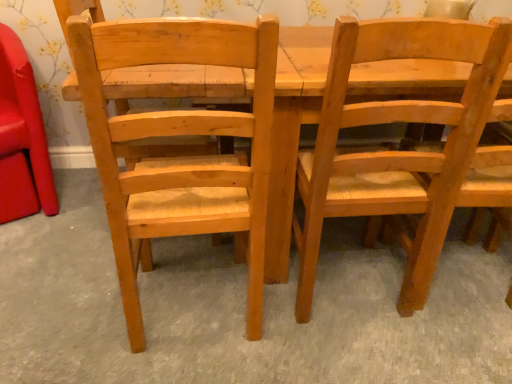
Question: Is there a large distance between light brown wood chair at center, the 3th chair in the left-to-right sequence, and matte wood chair at left, which appears as the 3th chair when viewed from the right?

Choices:
 (A) yes
 (B) no

Answer: (A)

Question: Is light brown wood chair at center, acting as the first chair starting from the right, shorter than matte wood chair at left, which is the first chair from left to right?

Choices:
 (A) yes
 (B) no

Answer: (B)

Question: From a real-world perspective, is light brown wood chair at center, the 3th chair in the left-to-right sequence, under matte wood chair at left, which appears as the 3th chair when viewed from the right?

Choices:
 (A) yes
 (B) no

Answer: (B)

Question: From a real-world perspective, is light brown wood chair at center, the 3th chair in the left-to-right sequence, positioned over matte wood chair at left, which is the first chair from left to right, based on gravity?

Choices:
 (A) yes
 (B) no

Answer: (A)

Question: Is light brown wood chair at center, the 3th chair in the left-to-right sequence, taller than matte wood chair at left, which is the first chair from left to right?

Choices:
 (A) yes
 (B) no

Answer: (A)

Question: Considering the positions of light brown wood chair at center, the 3th chair in the left-to-right sequence, and natural wood chair at left, which appears as the second chair when viewed from the left, in the image, is light brown wood chair at center, the 3th chair in the left-to-right sequence, wider or thinner than natural wood chair at left, which appears as the second chair when viewed from the left,?

Choices:
 (A) wide
 (B) thin

Answer: (A)

Question: In the image, is light brown wood chair at center, the 3th chair in the left-to-right sequence, on the left side or the right side of natural wood chair at left, marked as the second chair in a right-to-left arrangement?

Choices:
 (A) left
 (B) right

Answer: (B)

Question: From a real-world perspective, is light brown wood chair at center, the 3th chair in the left-to-right sequence, physically located above or below natural wood chair at left, which appears as the second chair when viewed from the left?

Choices:
 (A) below
 (B) above

Answer: (A)

Question: Considering the positions of point (479, 62) and point (133, 342), is point (479, 62) closer or farther from the camera than point (133, 342)?

Choices:
 (A) closer
 (B) farther

Answer: (A)

Question: Is matte wood chair at left, which is the first chair from left to right, in front of or behind light brown wood chair at center, acting as the first chair starting from the right, in the image?

Choices:
 (A) front
 (B) behind

Answer: (B)

Question: From the image's perspective, is matte wood chair at left, which is the first chair from left to right, positioned above or below light brown wood chair at center, the 3th chair in the left-to-right sequence?

Choices:
 (A) above
 (B) below

Answer: (A)

Question: From their relative heights in the image, would you say matte wood chair at left, which appears as the 3th chair when viewed from the right, is taller or shorter than light brown wood chair at center, acting as the first chair starting from the right?

Choices:
 (A) short
 (B) tall

Answer: (A)

Question: From a real-world perspective, is matte wood chair at left, which appears as the 3th chair when viewed from the right, physically located above or below light brown wood chair at center, the 3th chair in the left-to-right sequence?

Choices:
 (A) above
 (B) below

Answer: (B)

Question: Is natural wood chair at left, which appears as the second chair when viewed from the left, inside the boundaries of light brown wood chair at center, acting as the first chair starting from the right, or outside?

Choices:
 (A) inside
 (B) outside

Answer: (B)

Question: Considering the positions of natural wood chair at left, marked as the second chair in a right-to-left arrangement, and light brown wood chair at center, acting as the first chair starting from the right, in the image, is natural wood chair at left, marked as the second chair in a right-to-left arrangement, bigger or smaller than light brown wood chair at center, acting as the first chair starting from the right,?

Choices:
 (A) small
 (B) big

Answer: (B)